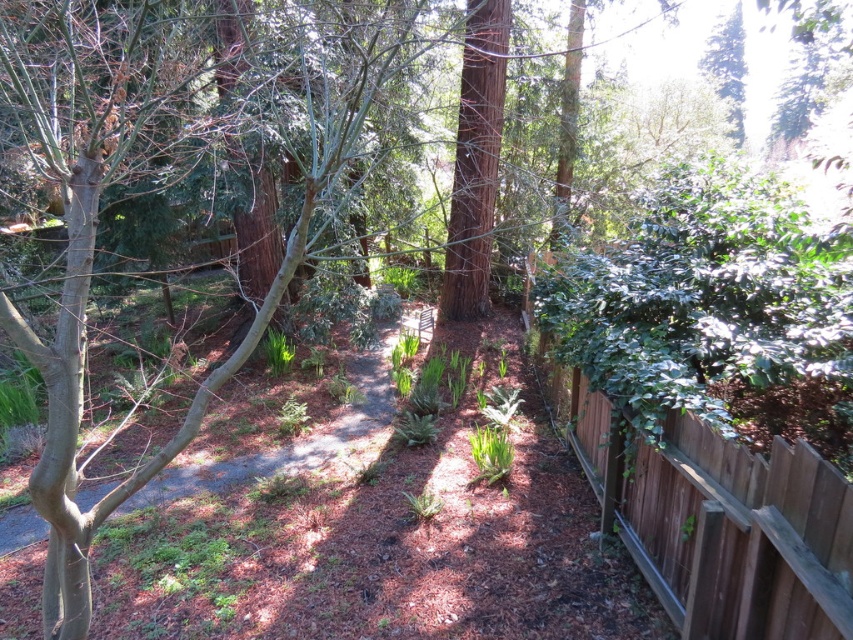
Is point (621, 426) closer to camera compared to point (218, 464)?

Yes, it is in front of point (218, 464).

Is brown wood fence at right below brown mulch at center?

Correct, brown wood fence at right is located below brown mulch at center.

Is point (727, 458) closer to camera compared to point (329, 435)?

Yes, it is in front of point (329, 435).

Locate an element on the screen. This screenshot has width=853, height=640. brown wood fence at right is located at coordinates 717,518.